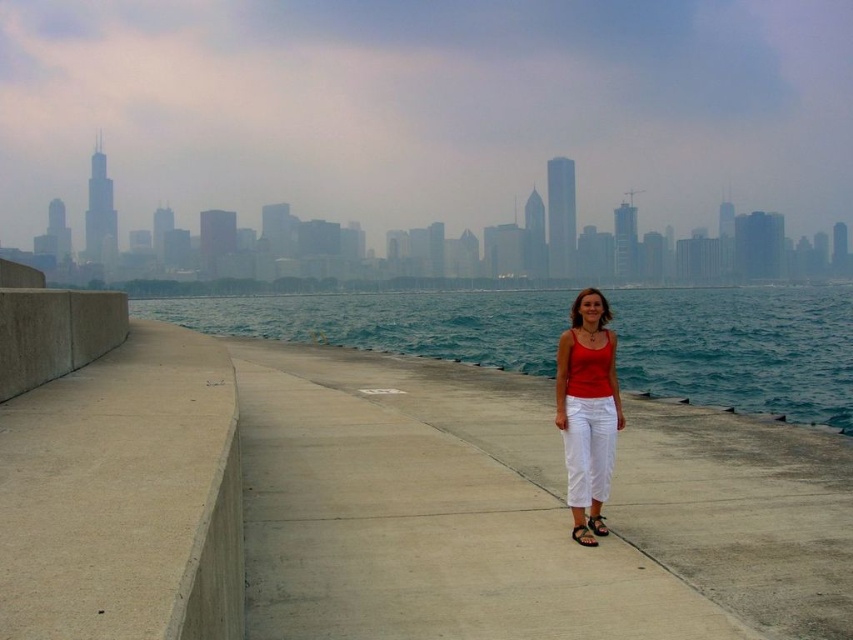
Can you confirm if blue water at center is thinner than black leather sandal at center?

No, blue water at center is not thinner than black leather sandal at center.

Which of these two, blue water at center or black leather sandal at center, stands taller?

Standing taller between the two is blue water at center.

Between point (677, 365) and point (578, 531), which one is positioned in front?

Positioned in front is point (578, 531).

Locate an element on the screen. The image size is (853, 640). blue water at center is located at coordinates (741, 348).

Is concrete at center closer to camera compared to black leather sandal at center?

Yes, it is in front of black leather sandal at center.

In the scene shown: Who is positioned more to the right, concrete at center or black leather sandal at center?

black leather sandal at center

Does point (521, 394) lie behind point (579, 524)?

Yes, point (521, 394) is farther from viewer.

In order to click on concrete at center in this screenshot , I will do `click(521, 513)`.

Based on the photo, how distant is black leather sandal at center from black rubber sandal at center?

They are 4.75 inches apart.

Can you confirm if black leather sandal at center is shorter than black rubber sandal at center?

Correct, black leather sandal at center is not as tall as black rubber sandal at center.

Does point (587, 540) lie behind point (595, 528)?

No, (587, 540) is closer to viewer.

Find the location of `black leather sandal at center`. black leather sandal at center is located at coordinates click(x=584, y=534).